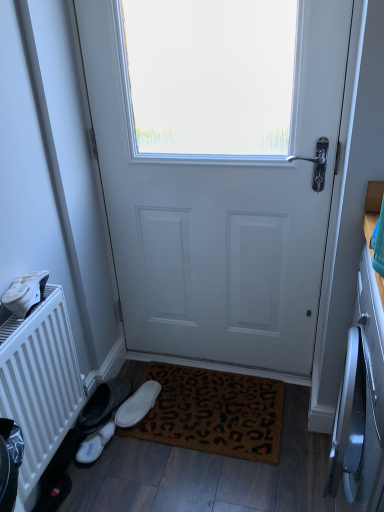
Question: Should I look upward or downward to see white matte radiator at left?

Choices:
 (A) down
 (B) up

Answer: (A)

Question: Would you say white suede slipper at lower left, the first footwear from the right, contains white matte radiator at left?

Choices:
 (A) no
 (B) yes

Answer: (A)

Question: Is white suede slipper at lower left, the first footwear from the right, turned away from white matte radiator at left?

Choices:
 (A) no
 (B) yes

Answer: (A)

Question: Considering the relative sizes of white suede slipper at lower left, the first footwear from the right, and white matte radiator at left in the image provided, is white suede slipper at lower left, the first footwear from the right, wider than white matte radiator at left?

Choices:
 (A) yes
 (B) no

Answer: (A)

Question: Considering the relative sizes of white suede slipper at lower left, marked as the second footwear in a left-to-right arrangement, and white matte radiator at left in the image provided, is white suede slipper at lower left, marked as the second footwear in a left-to-right arrangement, shorter than white matte radiator at left?

Choices:
 (A) yes
 (B) no

Answer: (A)

Question: Can you confirm if white suede slipper at lower left, the first footwear from the right, is taller than white matte radiator at left?

Choices:
 (A) yes
 (B) no

Answer: (B)

Question: Are white suede slipper at lower left, the first footwear from the right, and white matte radiator at left located far from each other?

Choices:
 (A) yes
 (B) no

Answer: (B)

Question: Is white suede slippers at lower left, arranged as the 2th footwear when viewed from the right, completely or partially outside of white matte radiator at left?

Choices:
 (A) yes
 (B) no

Answer: (A)

Question: Considering the relative sizes of white suede slippers at lower left, the 1th footwear from the left, and white matte radiator at left in the image provided, is white suede slippers at lower left, the 1th footwear from the left, wider than white matte radiator at left?

Choices:
 (A) yes
 (B) no

Answer: (B)

Question: Is white suede slippers at lower left, arranged as the 2th footwear when viewed from the right, further to camera compared to white matte radiator at left?

Choices:
 (A) no
 (B) yes

Answer: (B)

Question: Can white matte radiator at left be found inside white suede slippers at lower left, arranged as the 2th footwear when viewed from the right?

Choices:
 (A) no
 (B) yes

Answer: (A)

Question: Is white suede slippers at lower left, arranged as the 2th footwear when viewed from the right, far from white matte radiator at left?

Choices:
 (A) yes
 (B) no

Answer: (B)

Question: Is the depth of white suede slippers at lower left, arranged as the 2th footwear when viewed from the right, less than that of white matte radiator at left?

Choices:
 (A) yes
 (B) no

Answer: (B)

Question: From the image's perspective, does white matte door at center appear lower than white suede slippers at lower left, arranged as the 2th footwear when viewed from the right?

Choices:
 (A) no
 (B) yes

Answer: (A)